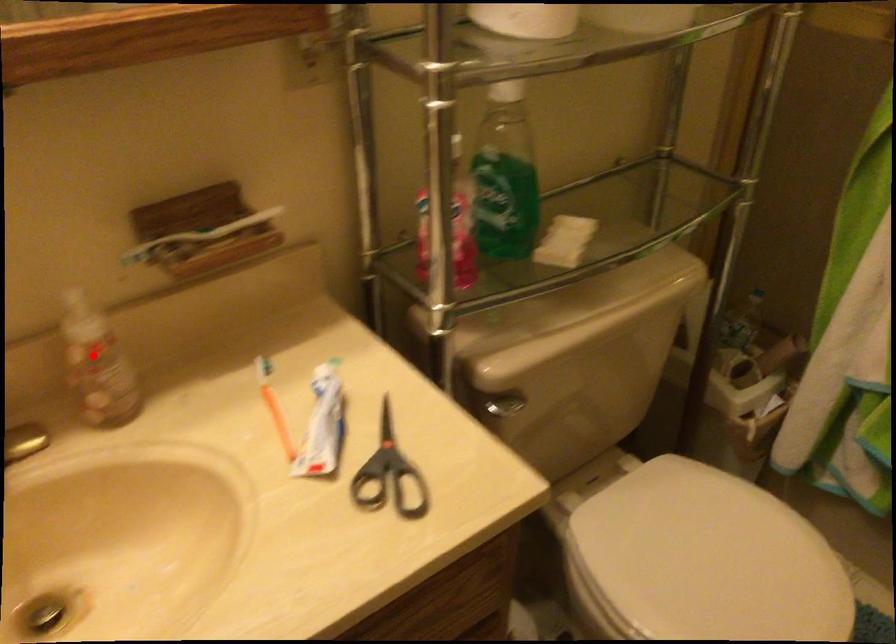
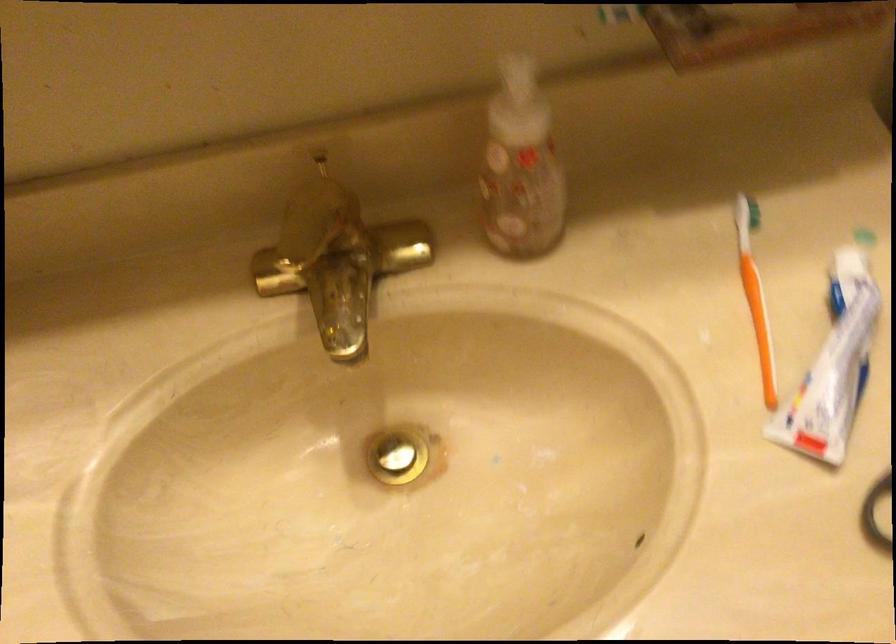
The point at the highlighted location is marked in the first image. Where is the corresponding point in the second image?

(521, 167)